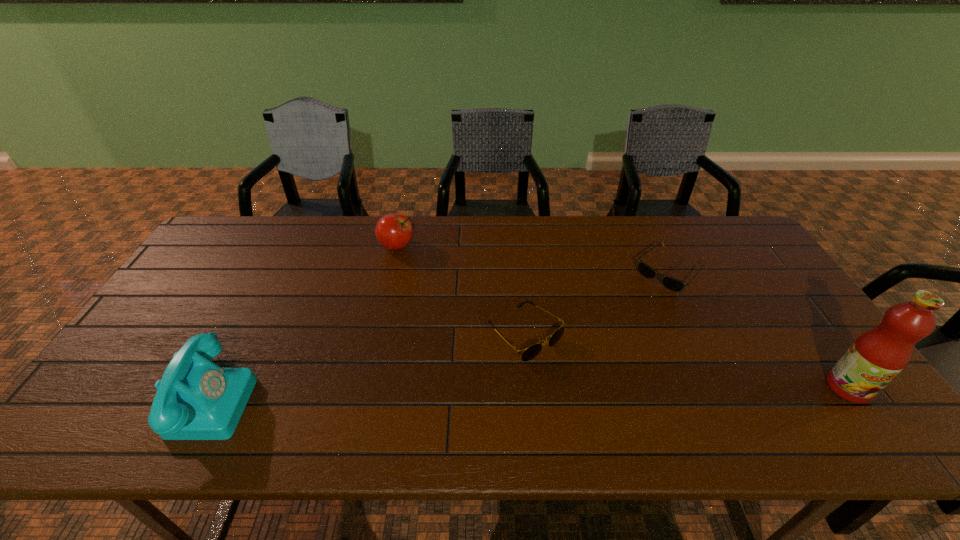
Where is `sunglasses situated at the far edge`? The height and width of the screenshot is (540, 960). sunglasses situated at the far edge is located at coordinates (670, 283).

Identify the location of telephone located in the near edge section of the desktop. Image resolution: width=960 pixels, height=540 pixels. (196, 399).

This screenshot has width=960, height=540. I want to click on fruit juice at the near edge, so click(x=877, y=356).

Where is `object located at the right edge`? Image resolution: width=960 pixels, height=540 pixels. object located at the right edge is located at coordinates 877,356.

At what (x,y) coordinates should I click in order to perform the action: click on object present at the near right corner. Please return your answer as a coordinate pair (x, y). The height and width of the screenshot is (540, 960). Looking at the image, I should click on (877, 356).

This screenshot has height=540, width=960. What are the coordinates of `free space at the far edge` in the screenshot? It's located at (276, 241).

In the image, there is a desktop. Identify the location of vacant space at the near edge. The width and height of the screenshot is (960, 540). (643, 380).

Where is `vacant space at the left edge`? vacant space at the left edge is located at coordinates (172, 314).

In the image, there is a desktop. Identify the location of vacant region at the right edge. Image resolution: width=960 pixels, height=540 pixels. (753, 272).

In the image, there is a desktop. Identify the location of vacant area at the far left corner. The width and height of the screenshot is (960, 540). (246, 222).